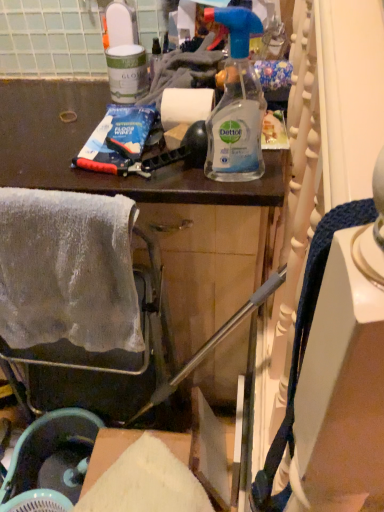
Question: Which direction should I rotate to look at clear plastic spray bottle at center, which is counted as the second bottle, starting from the back, — up or down?

Choices:
 (A) down
 (B) up

Answer: (B)

Question: Is matte black cabinet at upper center positioned before white matte paper towel at center?

Choices:
 (A) yes
 (B) no

Answer: (A)

Question: Is matte black cabinet at upper center oriented towards white matte paper towel at center?

Choices:
 (A) no
 (B) yes

Answer: (A)

Question: From the image's perspective, is matte black cabinet at upper center located above white matte paper towel at center?

Choices:
 (A) no
 (B) yes

Answer: (A)

Question: Can we say matte black cabinet at upper center lies outside white matte paper towel at center?

Choices:
 (A) yes
 (B) no

Answer: (A)

Question: Is matte black cabinet at upper center facing away from white matte paper towel at center?

Choices:
 (A) no
 (B) yes

Answer: (A)

Question: Considering the relative sizes of matte black cabinet at upper center and white matte paper towel at center in the image provided, is matte black cabinet at upper center bigger than white matte paper towel at center?

Choices:
 (A) no
 (B) yes

Answer: (B)

Question: Considering the relative sizes of matte black cabinet at upper center and clear plastic spray bottle at center, which is counted as the second bottle, starting from the back, in the image provided, is matte black cabinet at upper center wider than clear plastic spray bottle at center, which is counted as the second bottle, starting from the back,?

Choices:
 (A) yes
 (B) no

Answer: (A)

Question: Would you say matte black cabinet at upper center is outside clear plastic spray bottle at center, the first bottle in the bottom-to-top sequence?

Choices:
 (A) yes
 (B) no

Answer: (A)

Question: Is matte black cabinet at upper center bigger than clear plastic spray bottle at center, the first bottle viewed from the front?

Choices:
 (A) yes
 (B) no

Answer: (A)

Question: Is matte black cabinet at upper center positioned before clear plastic spray bottle at center, acting as the 2th bottle starting from the left?

Choices:
 (A) no
 (B) yes

Answer: (A)

Question: Considering the relative positions of matte black cabinet at upper center and clear plastic spray bottle at center, the first bottle in the bottom-to-top sequence, in the image provided, is matte black cabinet at upper center to the right of clear plastic spray bottle at center, the first bottle in the bottom-to-top sequence, from the viewer's perspective?

Choices:
 (A) no
 (B) yes

Answer: (A)

Question: From the image's perspective, is matte black cabinet at upper center beneath clear plastic spray bottle at center, marked as the 1th bottle in a right-to-left arrangement?

Choices:
 (A) no
 (B) yes

Answer: (B)

Question: From the image's perspective, would you say clear plastic spray bottle at center, which is counted as the second bottle, starting from the back, is positioned over white glossy paint can at upper left, the 1th bottle when ordered from top to bottom?

Choices:
 (A) no
 (B) yes

Answer: (A)